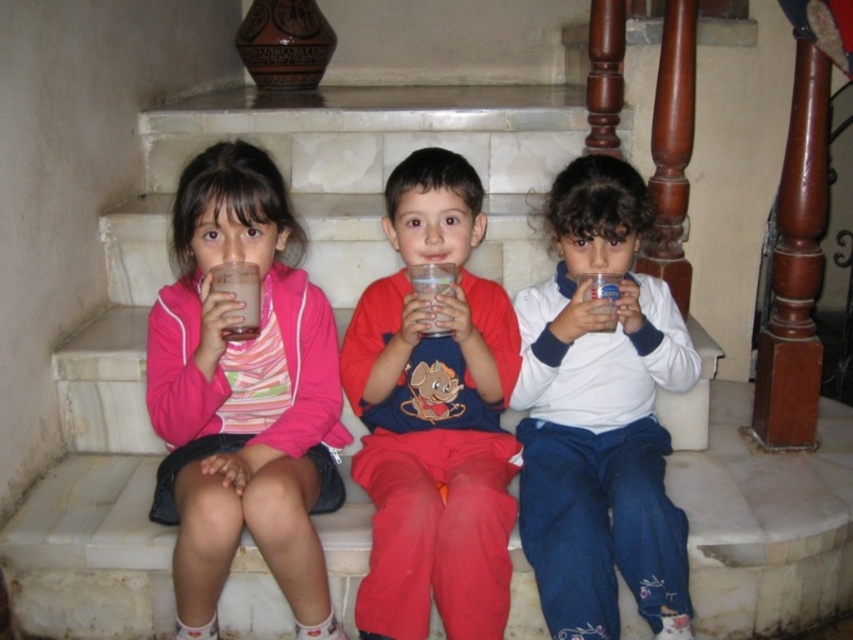
Does pink matte jacket at center lie in front of milky white liquid at left?

Yes, it is in front of milky white liquid at left.

Based on the photo, who is positioned more to the right, pink matte jacket at center or milky white liquid at left?

milky white liquid at left

Which is behind, point (175, 593) or point (259, 326)?

The point (259, 326) is more distant.

Identify the location of pink matte jacket at center. The width and height of the screenshot is (853, 640). (242, 396).

Between white matte shirt at center and milky white liquid at left, which one is positioned lower?

white matte shirt at center

Is point (651, 577) positioned behind point (215, 282)?

That is True.

The height and width of the screenshot is (640, 853). What are the coordinates of `white matte shirt at center` in the screenshot? It's located at (601, 417).

Is matte blue shirt at center to the left of milky white liquid at left from the viewer's perspective?

No, matte blue shirt at center is not to the left of milky white liquid at left.

Find the location of a particular element. matte blue shirt at center is located at coordinates (433, 417).

Which is behind, point (427, 540) or point (236, 296)?

Positioned behind is point (236, 296).

Locate an element on the screen. matte blue shirt at center is located at coordinates (433, 417).